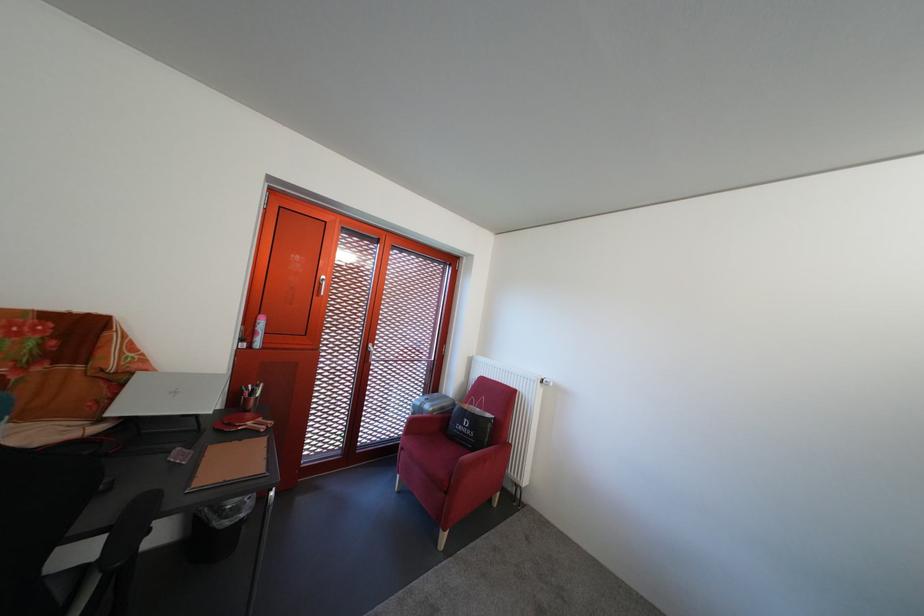
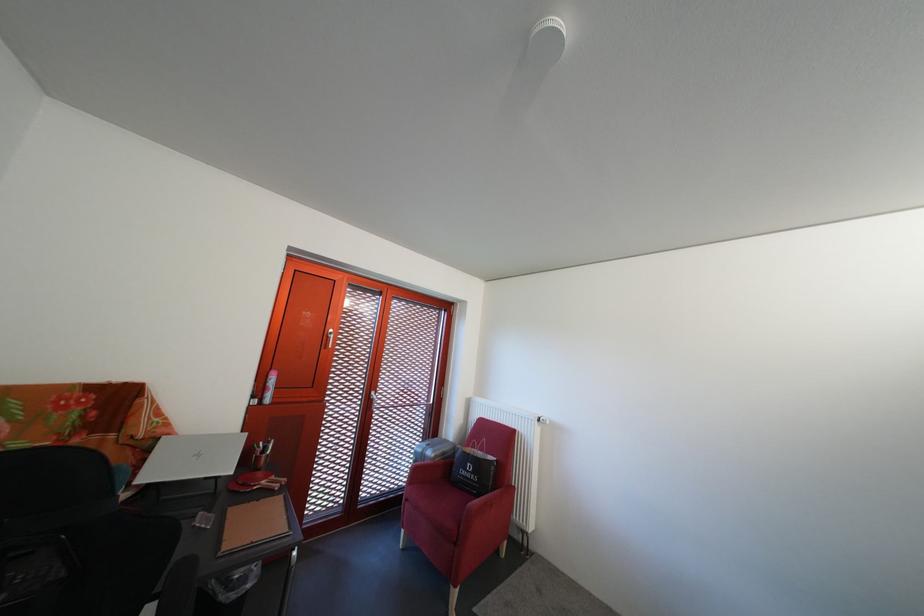
The point at (454,415) is marked in the first image. Where is the corresponding point in the second image?

(455, 460)